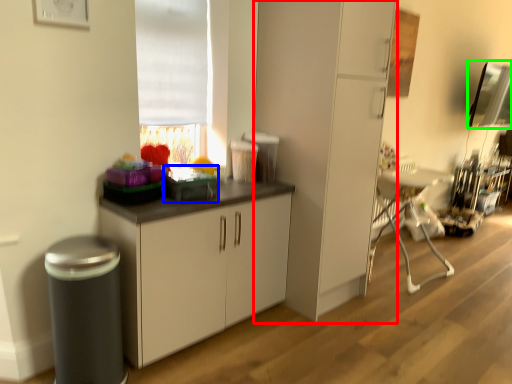
Question: Estimate the real-world distances between objects in this image. Which object is closer to cabinetry (highlighted by a red box), appliance (highlighted by a blue box) or window screen (highlighted by a green box)?

Choices:
 (A) appliance
 (B) window screen

Answer: (A)